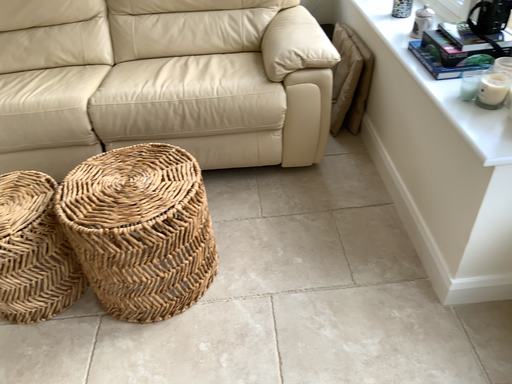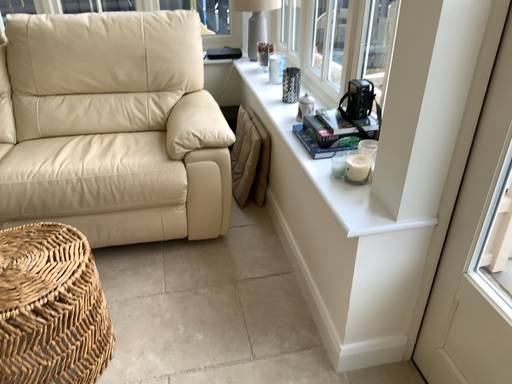
Question: How did the camera likely rotate when shooting the video?

Choices:
 (A) rotated upward
 (B) rotated downward

Answer: (A)